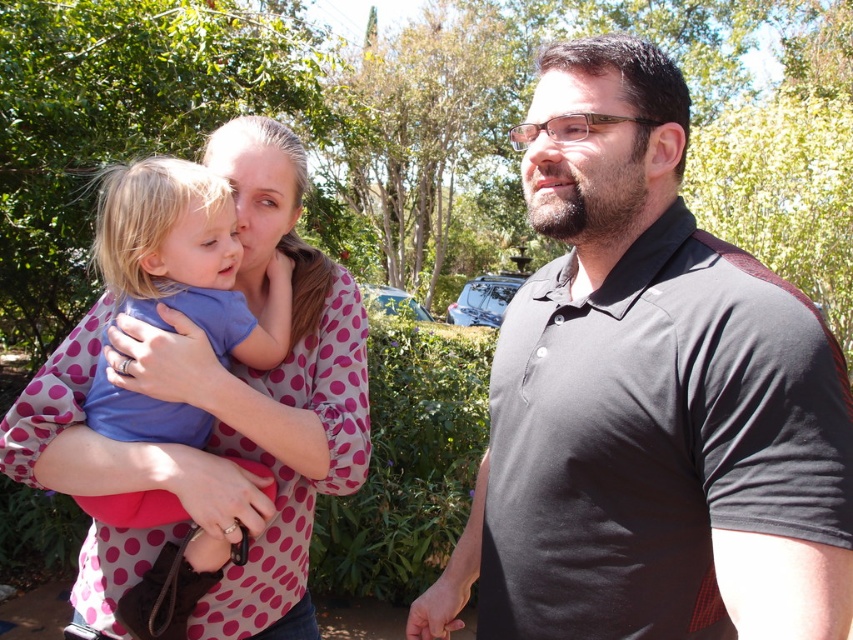
Can you confirm if black smooth polo shirt at right is positioned above pink polka dot blouse at upper left?

No.

Who is positioned more to the left, black smooth polo shirt at right or pink polka dot blouse at upper left?

pink polka dot blouse at upper left is more to the left.

Does point (518, 534) come in front of point (78, 336)?

That is True.

This screenshot has width=853, height=640. I want to click on black smooth polo shirt at right, so click(648, 401).